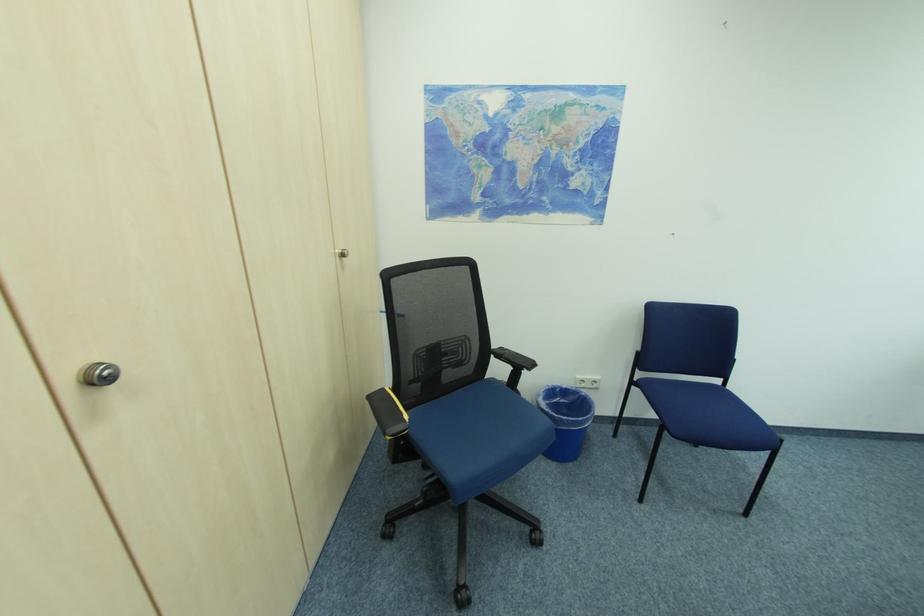
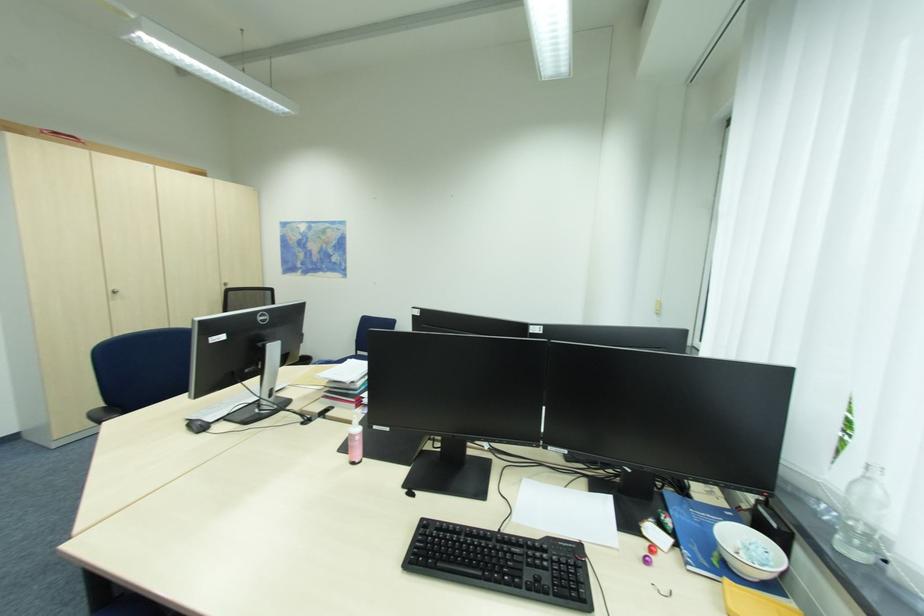
What movement of the cameraman would produce the second image?

The cameraman moved toward right, backward.